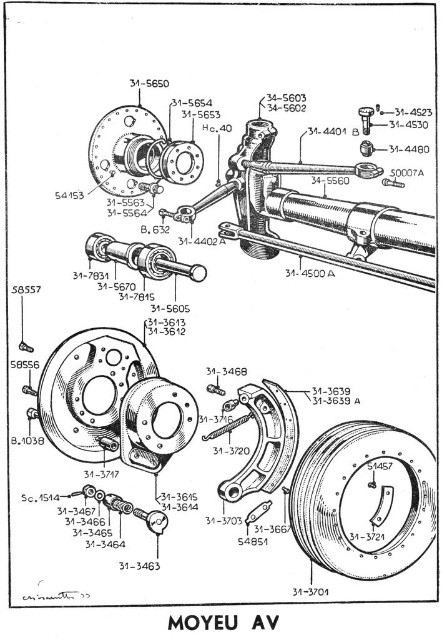
Looking at this image, you are an astronomer setting up your equipment. You have a matte black telescope at center and a matte silver rod at center. Which object should you adjust first if you need to align them vertically to ensure proper balance?

The matte black telescope at center is taller than the matte silver rod at center, so you should adjust the matte silver rod at center first to match the height of the matte black telescope at center for proper balance.

You are an astronomer setting up your equipment. You have a matte black telescope at center and a matte silver rod at center. Which object has a greater width?

The matte black telescope at center is wider than the matte silver rod at center according to the description.

You are an astronomer setting up your telescope. You have a matte black telescope at center and a matte silver rod at center. Which object is positioned closer to you?

A: The matte black telescope at center is closer to the viewer than the matte silver rod at center.